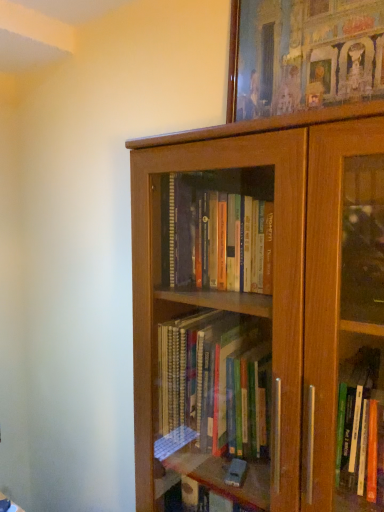
This screenshot has height=512, width=384. Describe the element at coordinates (303, 54) in the screenshot. I see `wooden picture frame at upper center` at that location.

Locate an element on the screen. This screenshot has width=384, height=512. wooden picture frame at upper center is located at coordinates (303, 54).

Where is `brown wood bookcase at center`? This screenshot has height=512, width=384. brown wood bookcase at center is located at coordinates (260, 314).

Describe the element at coordinates (260, 314) in the screenshot. This screenshot has width=384, height=512. I see `brown wood bookcase at center` at that location.

Where is `wooden picture frame at upper center`? This screenshot has height=512, width=384. wooden picture frame at upper center is located at coordinates (303, 54).

Considering the relative positions of brown wood bookcase at center and wooden picture frame at upper center in the image provided, is brown wood bookcase at center to the right of wooden picture frame at upper center from the viewer's perspective?

No, brown wood bookcase at center is not to the right of wooden picture frame at upper center.

Is the depth of brown wood bookcase at center greater than that of wooden picture frame at upper center?

No, brown wood bookcase at center is closer to the viewer.

Is point (208, 380) farther from viewer compared to point (378, 31)?

Yes, it is.

From the image's perspective, is brown wood bookcase at center positioned above or below wooden picture frame at upper center?

From the image's perspective, brown wood bookcase at center appears below wooden picture frame at upper center.

From a real-world perspective, between brown wood bookcase at center and wooden picture frame at upper center, who is vertically lower?

brown wood bookcase at center.

Does brown wood bookcase at center have a lesser width compared to wooden picture frame at upper center?

No.

Consider the image. Between brown wood bookcase at center and wooden picture frame at upper center, which one has more height?

brown wood bookcase at center.

Between brown wood bookcase at center and wooden picture frame at upper center, which one has larger size?

Bigger between the two is brown wood bookcase at center.

Is brown wood bookcase at center inside the boundaries of wooden picture frame at upper center, or outside?

brown wood bookcase at center lies outside wooden picture frame at upper center.

Does brown wood bookcase at center touch wooden picture frame at upper center?

No, brown wood bookcase at center is not touching wooden picture frame at upper center.

Is brown wood bookcase at center facing away from wooden picture frame at upper center?

brown wood bookcase at center does not have its back to wooden picture frame at upper center.

At what (x,y) coordinates should I click in order to perform the action: click on bookcase in front of the wooden picture frame at upper center. Please return your answer as a coordinate pair (x, y). Looking at the image, I should click on (260, 314).

Is wooden picture frame at upper center at the right side of brown wood bookcase at center?

Correct, you'll find wooden picture frame at upper center to the right of brown wood bookcase at center.

Is wooden picture frame at upper center in front of brown wood bookcase at center?

No, the depth of wooden picture frame at upper center is greater than that of brown wood bookcase at center.

Is point (273, 26) closer or farther from the camera than point (375, 409)?

Point (273, 26).

From the image's perspective, would you say wooden picture frame at upper center is shown under brown wood bookcase at center?

No, from the image's perspective, wooden picture frame at upper center is not beneath brown wood bookcase at center.

From a real-world perspective, is wooden picture frame at upper center over brown wood bookcase at center?

Correct, in the physical world, wooden picture frame at upper center is higher than brown wood bookcase at center.

Between wooden picture frame at upper center and brown wood bookcase at center, which one has larger width?

Wider between the two is brown wood bookcase at center.

Is wooden picture frame at upper center shorter than brown wood bookcase at center?

Yes, wooden picture frame at upper center is shorter than brown wood bookcase at center.

Which of these two, wooden picture frame at upper center or brown wood bookcase at center, is smaller?

wooden picture frame at upper center is smaller.

Is wooden picture frame at upper center located outside brown wood bookcase at center?

Yes.

Is wooden picture frame at upper center beside brown wood bookcase at center?

No, wooden picture frame at upper center is not beside brown wood bookcase at center.

Is wooden picture frame at upper center oriented towards brown wood bookcase at center?

No, wooden picture frame at upper center is not oriented towards brown wood bookcase at center.

Looking at this image, how different are the orientations of wooden picture frame at upper center and brown wood bookcase at center in degrees?

1.37 degrees separate the facing orientations of wooden picture frame at upper center and brown wood bookcase at center.

Locate an element on the screen. Image resolution: width=384 pixels, height=512 pixels. picture frame behind the brown wood bookcase at center is located at coordinates (303, 54).

You are a GUI agent. You are given a task and a screenshot of the screen. Output one action in this format:
    pyautogui.click(x=<x>, y=<y>)
    Task: Click on the picture frame that appears above the brown wood bookcase at center (from a real-world perspective)
    
    Given the screenshot: What is the action you would take?
    pyautogui.click(x=303, y=54)

Image resolution: width=384 pixels, height=512 pixels. Find the location of `bookcase below the wooden picture frame at upper center (from a real-world perspective)`. bookcase below the wooden picture frame at upper center (from a real-world perspective) is located at coordinates (260, 314).